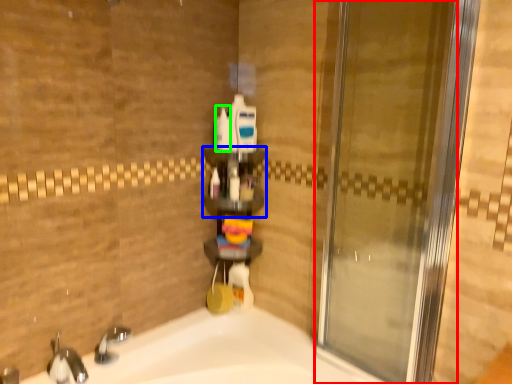
Question: Which is nearer to the door (highlighted by a red box)? shelf (highlighted by a blue box) or toiletry (highlighted by a green box).

Choices:
 (A) shelf
 (B) toiletry

Answer: (A)